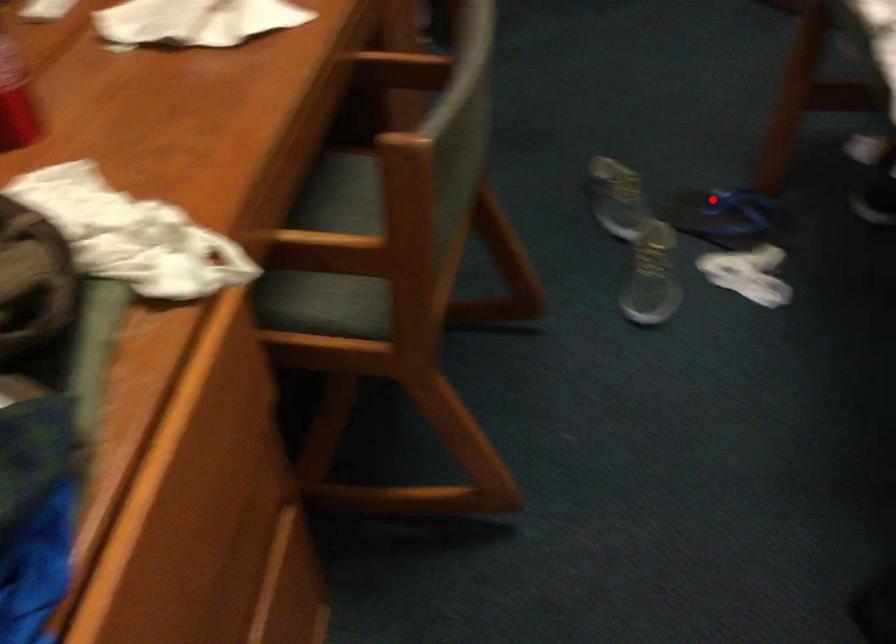
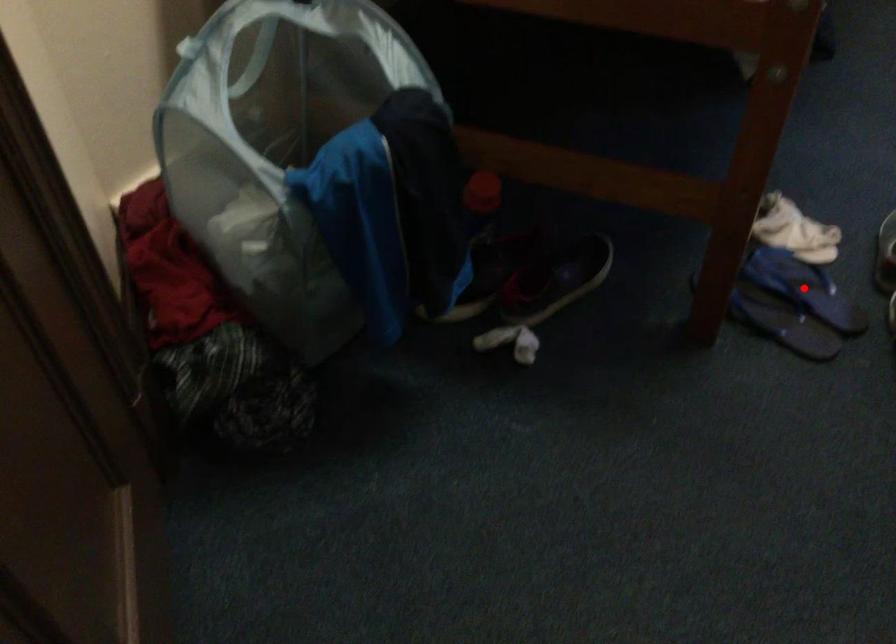
I am providing you with two images of the same scene from different viewpoints. A red point is marked on the first image and another point is marked on the second image. Does the point marked in image1 correspond to the same location as the one in image2?

No